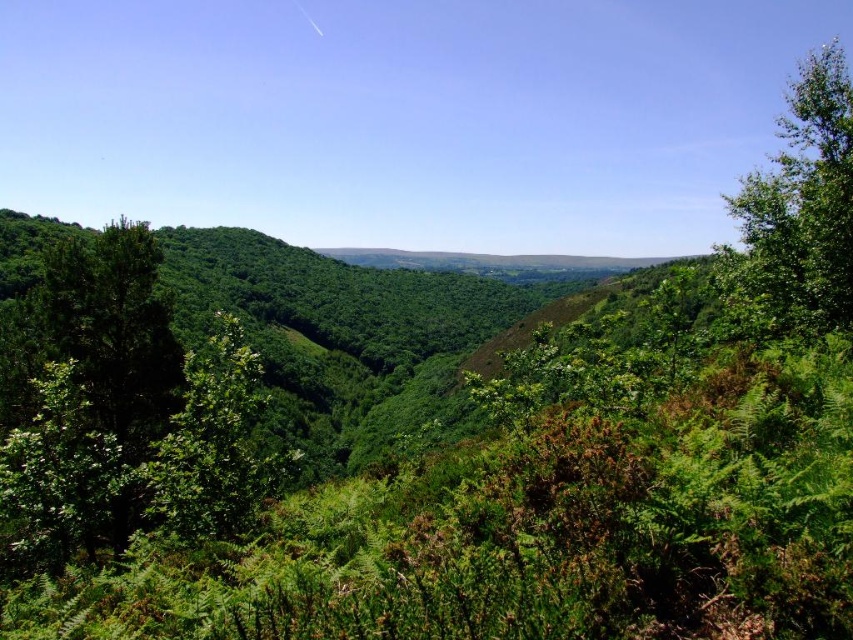
You are standing in the lush landscape and want to walk towards the green leafy tree at center. However, there is a green leafy tree at right in your path. Which tree will you encounter first?

You will encounter the green leafy tree at right first because it is closer to you than the green leafy tree at center.

You are an environmental scientist studying the canopy structure of this forest. You observe the green leafy tree at right and the green leafy tree at center. Which tree is located higher in the vertical canopy layers?

The green leafy tree at right is positioned over the green leafy tree at center, meaning it is higher in the vertical canopy layers.